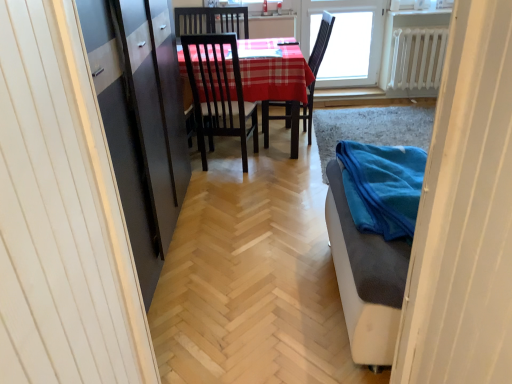
Question: Considering the positions of point (376, 6) and point (492, 240), is point (376, 6) closer or farther from the camera than point (492, 240)?

Choices:
 (A) farther
 (B) closer

Answer: (A)

Question: From the image's perspective, is transparent glass window at upper center located above or below blue fabric at lower right?

Choices:
 (A) above
 (B) below

Answer: (A)

Question: Based on their relative distances, which object is nearer to the white metallic radiator at upper right?

Choices:
 (A) blue fabric at lower right
 (B) transparent glass window at upper center

Answer: (B)

Question: Which is nearer to the blue fabric at lower right?

Choices:
 (A) transparent glass window at upper center
 (B) white metallic radiator at upper right

Answer: (A)